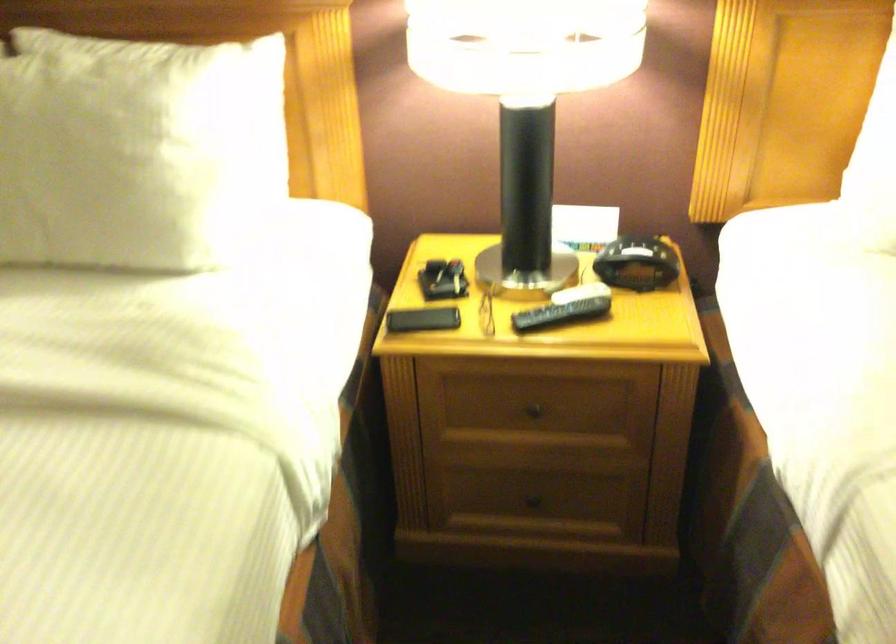
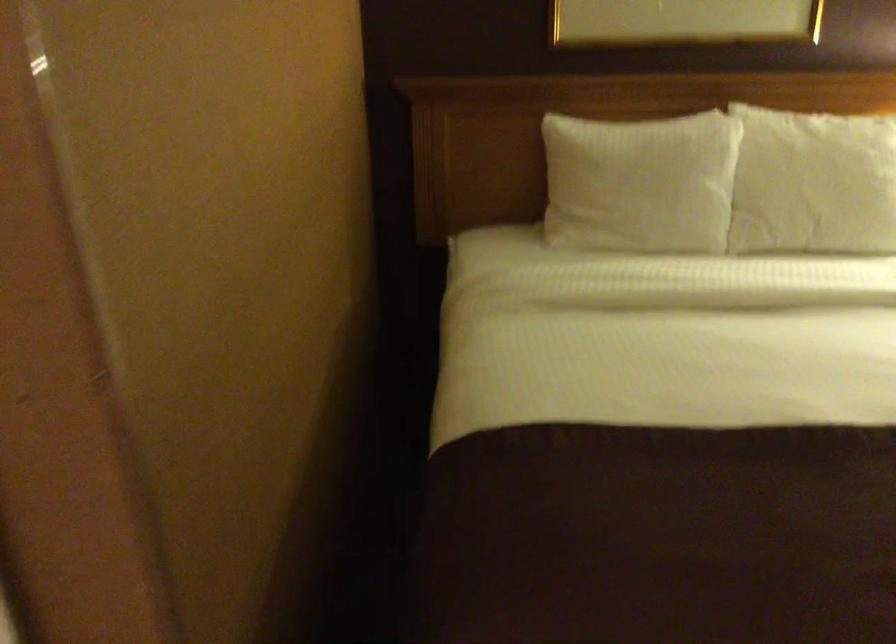
Based on the photo, what movement of the cameraman would produce the second image?

The cameraman moved toward left, backward.